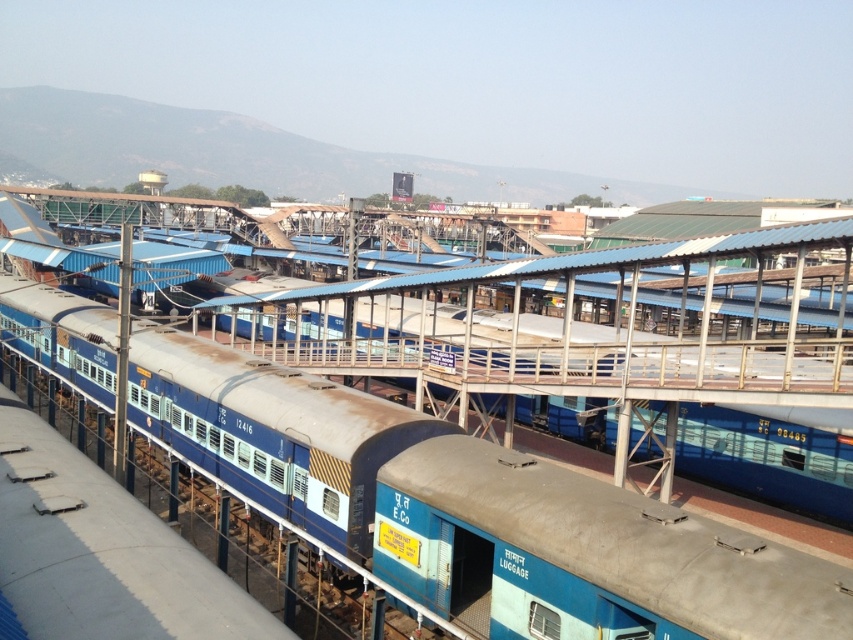
You are a passenger at the railway station and need to place your blue matte luggage at center onto the blue painted metal train car at center. Can you directly place it on top without moving the luggage from its current position?

The blue painted metal train car at center is above the blue matte luggage at center, so yes, you can directly place it on top without moving the luggage from its current position since the train car is already positioned above it.

Consider the image. You are a passenger at the railway station and need to place your blue matte luggage at center onto the blue painted metal train car at center. Can you fit the luggage inside the train car?

The blue painted metal train car at center has a larger size compared to blue matte luggage at center, so yes, the luggage can fit inside the train car.